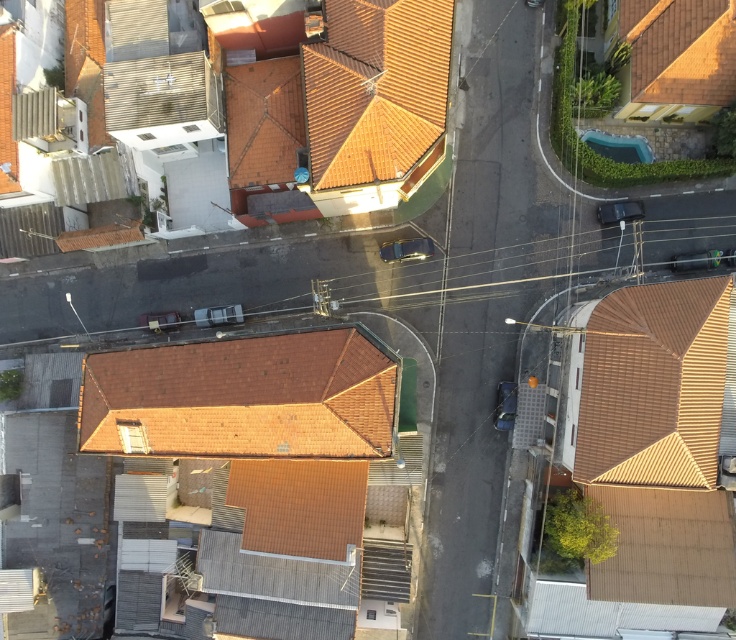
Question: Which object is farther from the camera taking this photo?

Choices:
 (A) brown tile roof at center
 (B) orange clay tiles at upper center
 (C) brown tile roof at lower right

Answer: (B)

Question: Can you confirm if brown tile roof at center is thinner than brown tile roof at lower right?

Choices:
 (A) no
 (B) yes

Answer: (A)

Question: Based on their relative distances, which object is nearer to the brown tile roof at lower right?

Choices:
 (A) brown tile roof at center
 (B) orange clay tiles at upper center

Answer: (B)

Question: Which of the following is the closest to the observer?

Choices:
 (A) orange clay tiles at upper center
 (B) brown tile roof at lower right

Answer: (B)

Question: Can you confirm if brown tile roof at center is positioned below orange clay tiles at upper center?

Choices:
 (A) no
 (B) yes

Answer: (B)

Question: Is brown tile roof at lower right thinner than orange clay tiles at upper center?

Choices:
 (A) no
 (B) yes

Answer: (B)